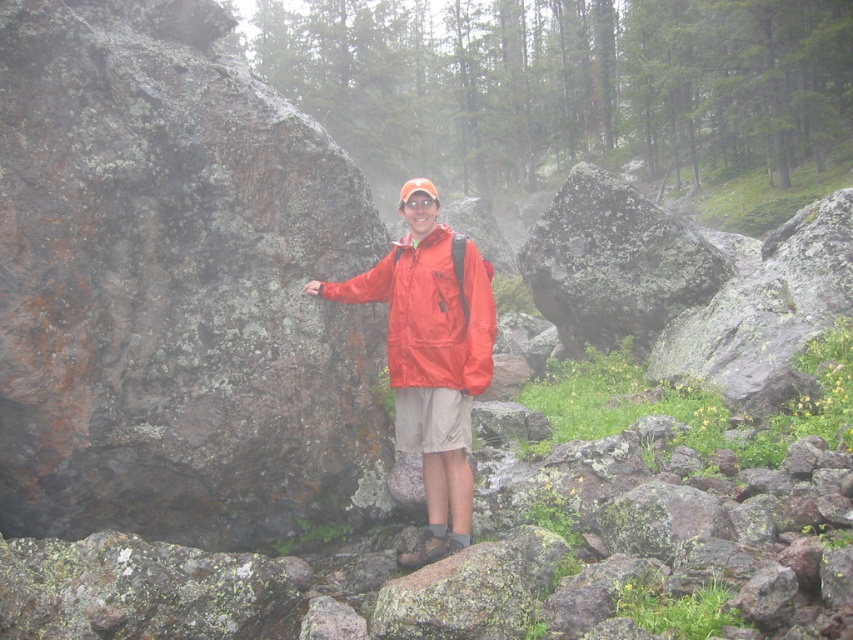
Which is above, matte orange jacket at center or green mossy rock at center?

Positioned higher is matte orange jacket at center.

Which is behind, point (460, 353) or point (584, 324)?

The point (584, 324) is behind.

Who is more distant from viewer, [430,422] or [577,173]?

The point [577,173] is more distant.

You are a GUI agent. You are given a task and a screenshot of the screen. Output one action in this format:
    pyautogui.click(x=<x>, y=<y>)
    Task: Click on the matte orange jacket at center
    
    Given the screenshot: What is the action you would take?
    pyautogui.click(x=431, y=356)

Based on the photo, does green mossy rock at center appear on the left side of matte red jacket at center?

In fact, green mossy rock at center is to the right of matte red jacket at center.

Is green mossy rock at center closer to the viewer compared to matte red jacket at center?

No, it is not.

Who is more forward, [552,243] or [474,371]?

Positioned in front is point [474,371].

You are a GUI agent. You are given a task and a screenshot of the screen. Output one action in this format:
    pyautogui.click(x=<x>, y=<y>)
    Task: Click on the green mossy rock at center
    The width and height of the screenshot is (853, 640).
    Given the screenshot: What is the action you would take?
    pyautogui.click(x=614, y=264)

Does matte orange jacket at center appear on the left side of matte red jacket at center?

In fact, matte orange jacket at center is to the right of matte red jacket at center.

Is point (445, 241) positioned after point (421, 316)?

Yes, point (445, 241) is behind point (421, 316).

At what (x,y) coordinates should I click in order to perform the action: click on matte orange jacket at center. Please return your answer as a coordinate pair (x, y). The image size is (853, 640). Looking at the image, I should click on coord(431,356).